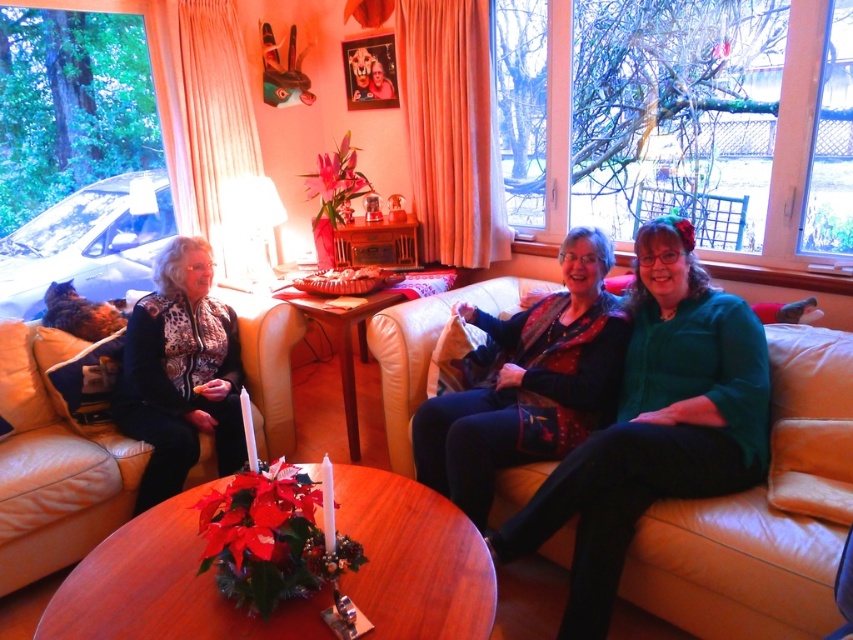
Question: Which point is farther to the camera?

Choices:
 (A) leather couch at lower left
 (B) patterned fabric jacket at left

Answer: (B)

Question: Is leather couch at lower left closer to the viewer compared to velvet green sweater at center?

Choices:
 (A) no
 (B) yes

Answer: (A)

Question: Is leather couch at lower left bigger than velvet green sweater at center?

Choices:
 (A) yes
 (B) no

Answer: (B)

Question: Among these points, which one is farthest from the camera?

Choices:
 (A) (199, 284)
 (B) (62, 413)
 (C) (741, 602)
 (D) (512, 371)

Answer: (A)

Question: Based on their relative distances, which object is farther from the leather couch at center?

Choices:
 (A) patterned fabric jacket at left
 (B) leather couch at lower left
 (C) velvet green sweater at center

Answer: (B)

Question: Does leather couch at lower left have a larger size compared to velvet green sweater at center?

Choices:
 (A) yes
 (B) no

Answer: (B)